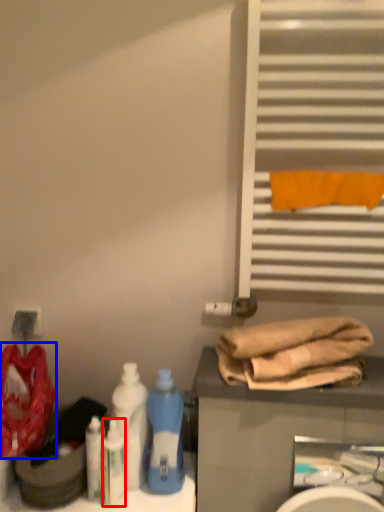
Question: Which object appears closest to the camera in this image, cleaning product (highlighted by a red box) or material (highlighted by a blue box)?

Choices:
 (A) cleaning product
 (B) material

Answer: (B)